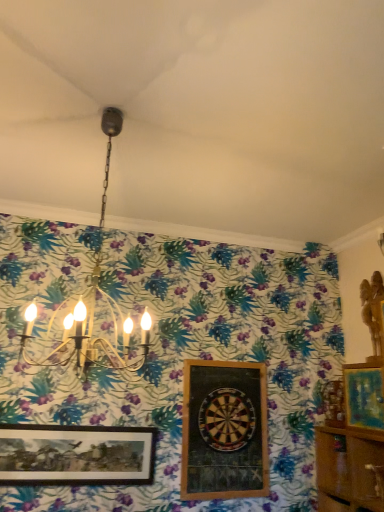
Question: From the image's perspective, relative to wooden framed dartboard at center, the second picture frame when ordered from right to left, is wooden dartboard at center above or below?

Choices:
 (A) below
 (B) above

Answer: (B)

Question: From their relative heights in the image, would you say wooden dartboard at center is taller or shorter than wooden framed dartboard at center, which is counted as the 2th picture frame, starting from the left?

Choices:
 (A) short
 (B) tall

Answer: (A)

Question: Which of these objects is positioned farthest from the gold metallic chandelier at upper center?

Choices:
 (A) wooden framed dartboard at center, which is counted as the 2th picture frame, starting from the left
 (B) wooden dartboard at center
 (C) wooden cabinet at lower right
 (D) teal matte painting at right, the 3th picture frame viewed from the left
 (E) wooden framed picture at lower left, placed as the third picture frame when sorted from right to left

Answer: (C)

Question: Which of these objects is positioned closest to the wooden framed picture at lower left, the 1th picture frame when ordered from left to right?

Choices:
 (A) gold metallic chandelier at upper center
 (B) wooden cabinet at lower right
 (C) wooden framed dartboard at center, the second picture frame when ordered from right to left
 (D) wooden dartboard at center
 (E) teal matte painting at right, the first picture frame viewed from the right

Answer: (C)